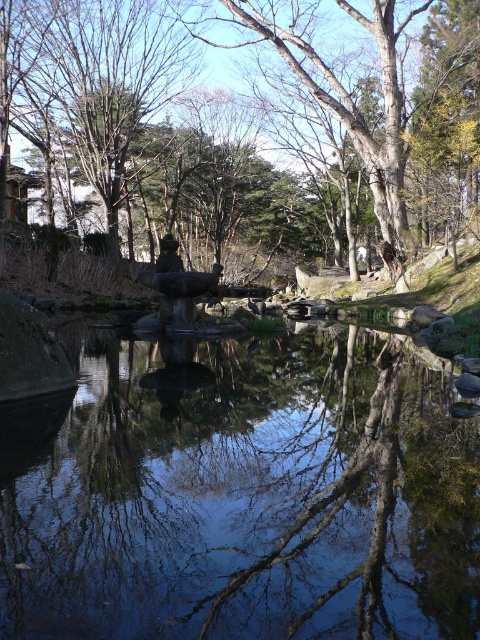
Question: Which point is closer to the camera taking this photo?

Choices:
 (A) (411, 8)
 (B) (285, 618)

Answer: (B)

Question: Can you confirm if transparent water at center is positioned above brown wood tree at center?

Choices:
 (A) no
 (B) yes

Answer: (A)

Question: Among these objects, which one is farthest from the camera?

Choices:
 (A) transparent water at center
 (B) brown wood tree at center

Answer: (B)

Question: Does transparent water at center have a lesser width compared to brown wood tree at center?

Choices:
 (A) no
 (B) yes

Answer: (B)

Question: Is transparent water at center to the left of brown wood tree at center from the viewer's perspective?

Choices:
 (A) yes
 (B) no

Answer: (A)